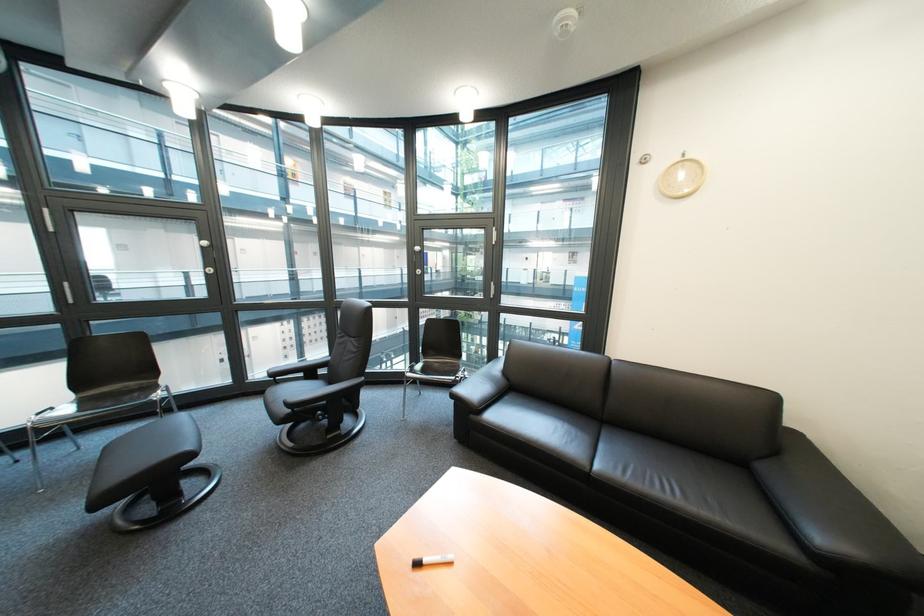
Which object does [144,464] point to?

It refers to a black footrest.